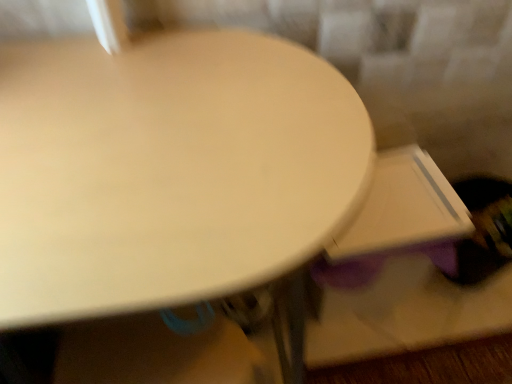
In order to face matte wood table at center, should I rotate leftwards or rightwards?

Rotate your view left by about 18.512°.

The width and height of the screenshot is (512, 384). What are the coordinates of `matte wood table at center` in the screenshot? It's located at (168, 171).

Describe the element at coordinates (168, 171) in the screenshot. I see `matte wood table at center` at that location.

I want to click on matte wood table at center, so click(x=168, y=171).